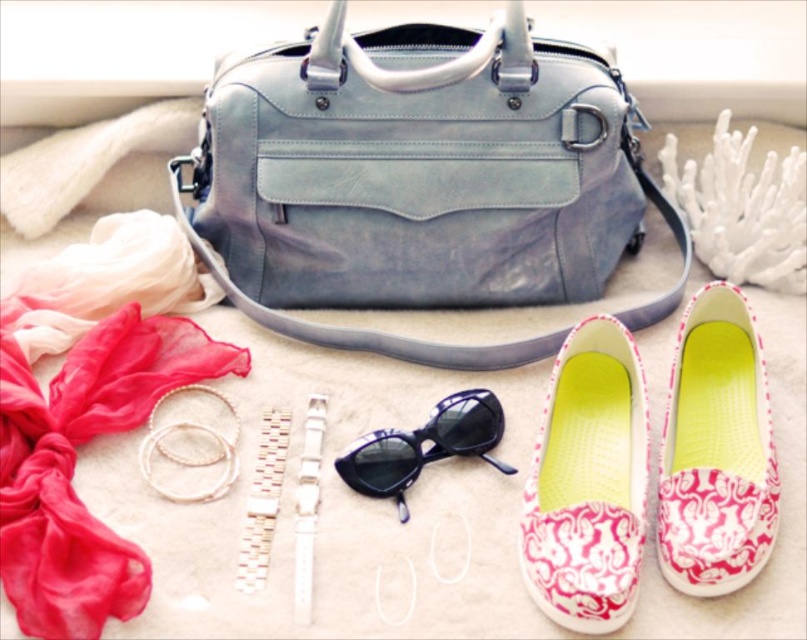
Is silky chiffon scarf at upper left above black plastic sunglasses at center?

Yes.

At what (x,y) coordinates should I click in order to perform the action: click on silky chiffon scarf at upper left. Please return your answer as a coordinate pair (x, y). The height and width of the screenshot is (640, 807). Looking at the image, I should click on (74, 465).

This screenshot has width=807, height=640. What do you see at coordinates (74, 465) in the screenshot?
I see `silky chiffon scarf at upper left` at bounding box center [74, 465].

The height and width of the screenshot is (640, 807). I want to click on silky chiffon scarf at upper left, so click(x=74, y=465).

Does matte blue leather bag at upper center have a greater height compared to pink damask slip-on shoes at lower right?

Yes.

Is matte blue leather bag at upper center thinner than pink damask slip-on shoes at lower right?

No, matte blue leather bag at upper center is not thinner than pink damask slip-on shoes at lower right.

Describe the element at coordinates (420, 180) in the screenshot. I see `matte blue leather bag at upper center` at that location.

Locate an element on the screen. The image size is (807, 640). matte blue leather bag at upper center is located at coordinates (420, 180).

Can you confirm if matte blue leather bag at upper center is bigger than silky chiffon scarf at upper left?

Yes.

Who is more forward, (513, 243) or (44, 614)?

Positioned in front is point (44, 614).

Find the location of a particular element. matte blue leather bag at upper center is located at coordinates (420, 180).

Locate an element on the screen. This screenshot has height=640, width=807. matte blue leather bag at upper center is located at coordinates (420, 180).